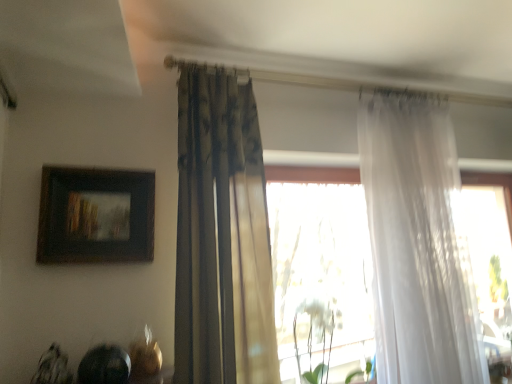
Question: Is translucent white curtain at right, the second curtain viewed from the left, further to the viewer compared to white matte plant at center?

Choices:
 (A) yes
 (B) no

Answer: (B)

Question: Does translucent white curtain at right, the second curtain viewed from the left, have a greater width compared to white matte plant at center?

Choices:
 (A) yes
 (B) no

Answer: (A)

Question: Is translucent white curtain at right, the second curtain viewed from the left, far from white matte plant at center?

Choices:
 (A) yes
 (B) no

Answer: (B)

Question: Is translucent white curtain at right, the 1th curtain in the right-to-left sequence, at the right side of white matte plant at center?

Choices:
 (A) no
 (B) yes

Answer: (B)

Question: From a real-world perspective, is translucent white curtain at right, the second curtain viewed from the left, under white matte plant at center?

Choices:
 (A) no
 (B) yes

Answer: (A)

Question: From a real-world perspective, is translucent white curtain at right, the second curtain viewed from the left, positioned over white matte plant at center based on gravity?

Choices:
 (A) no
 (B) yes

Answer: (B)

Question: Is white matte plant at center shorter than textured beige curtain at center, which is counted as the first curtain, starting from the left?

Choices:
 (A) yes
 (B) no

Answer: (A)

Question: Is white matte plant at center touching textured beige curtain at center, which is counted as the first curtain, starting from the left?

Choices:
 (A) no
 (B) yes

Answer: (A)

Question: Does white matte plant at center lie behind textured beige curtain at center, which ranks as the 2th curtain in right-to-left order?

Choices:
 (A) no
 (B) yes

Answer: (B)

Question: From a real-world perspective, is white matte plant at center located higher than textured beige curtain at center, which ranks as the 2th curtain in right-to-left order?

Choices:
 (A) yes
 (B) no

Answer: (B)

Question: Is white matte plant at center facing towards textured beige curtain at center, which ranks as the 2th curtain in right-to-left order?

Choices:
 (A) no
 (B) yes

Answer: (A)

Question: Does white matte plant at center have a larger size compared to textured beige curtain at center, which ranks as the 2th curtain in right-to-left order?

Choices:
 (A) no
 (B) yes

Answer: (A)

Question: Considering the relative positions of translucent white curtain at right, the second curtain viewed from the left, and wooden framed painting at upper left in the image provided, is translucent white curtain at right, the second curtain viewed from the left, to the left of wooden framed painting at upper left from the viewer's perspective?

Choices:
 (A) no
 (B) yes

Answer: (A)